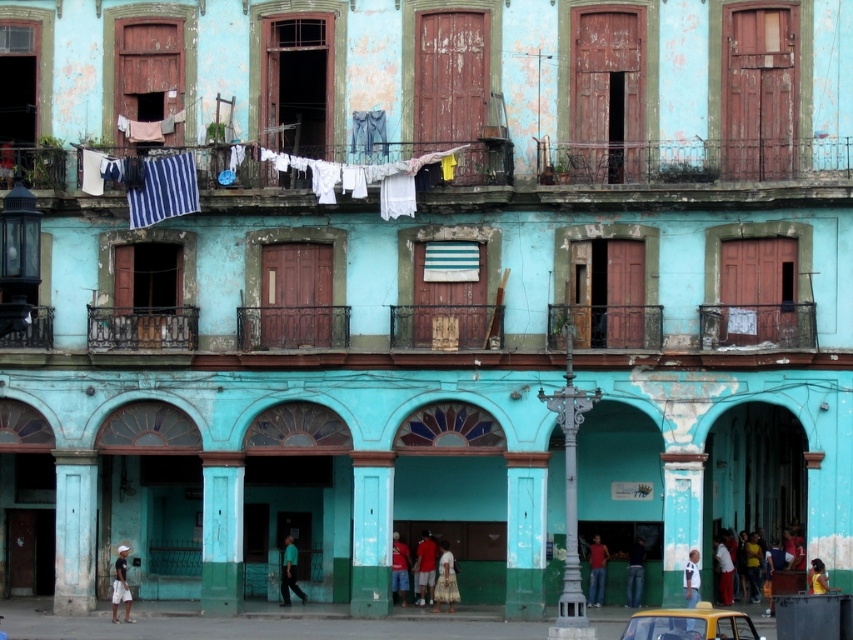
Who is positioned more to the left, yellow matte taxi at lower center or red fabric pants at lower center?

red fabric pants at lower center

Which is in front, point (703, 636) or point (399, 580)?

Point (703, 636) is in front.

Is point (656, 620) farther from viewer compared to point (405, 588)?

That is False.

Locate an element on the screen. This screenshot has width=853, height=640. yellow matte taxi at lower center is located at coordinates pyautogui.click(x=689, y=625).

This screenshot has width=853, height=640. What do you see at coordinates (689, 625) in the screenshot?
I see `yellow matte taxi at lower center` at bounding box center [689, 625].

Measure the distance from yellow matte taxi at lower center to green matte shirt at lower center.

The distance of yellow matte taxi at lower center from green matte shirt at lower center is 48.02 feet.

What do you see at coordinates (689, 625) in the screenshot?
I see `yellow matte taxi at lower center` at bounding box center [689, 625].

I want to click on yellow matte taxi at lower center, so click(689, 625).

Who is lower down, white fabric at lower right or yellow fabric person at lower right?

white fabric at lower right

Does point (721, 576) lie behind point (820, 589)?

Yes.

You are a GUI agent. You are given a task and a screenshot of the screen. Output one action in this format:
    pyautogui.click(x=<x>, y=<y>)
    Task: Click on the white fabric at lower right
    The image size is (853, 640).
    Given the screenshot: What is the action you would take?
    pyautogui.click(x=723, y=572)